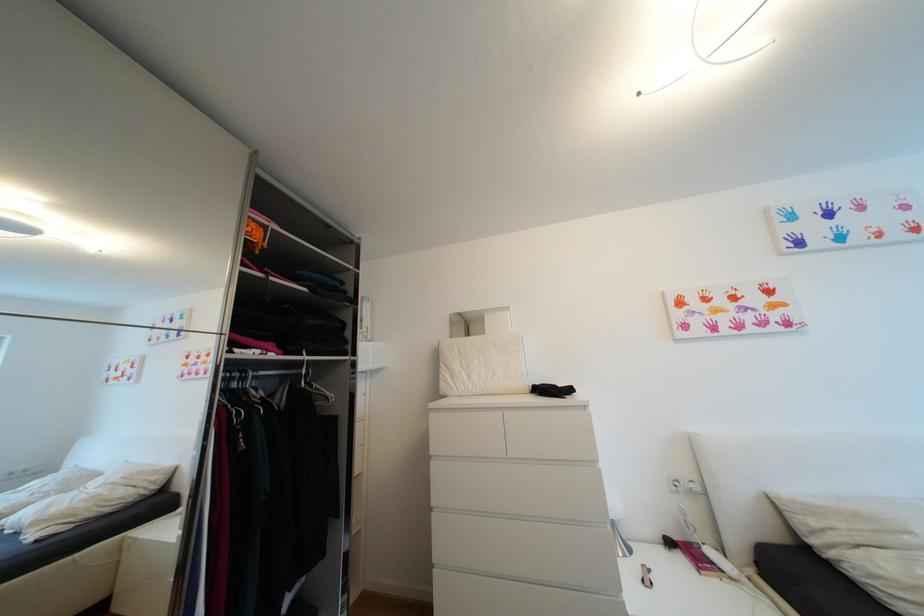
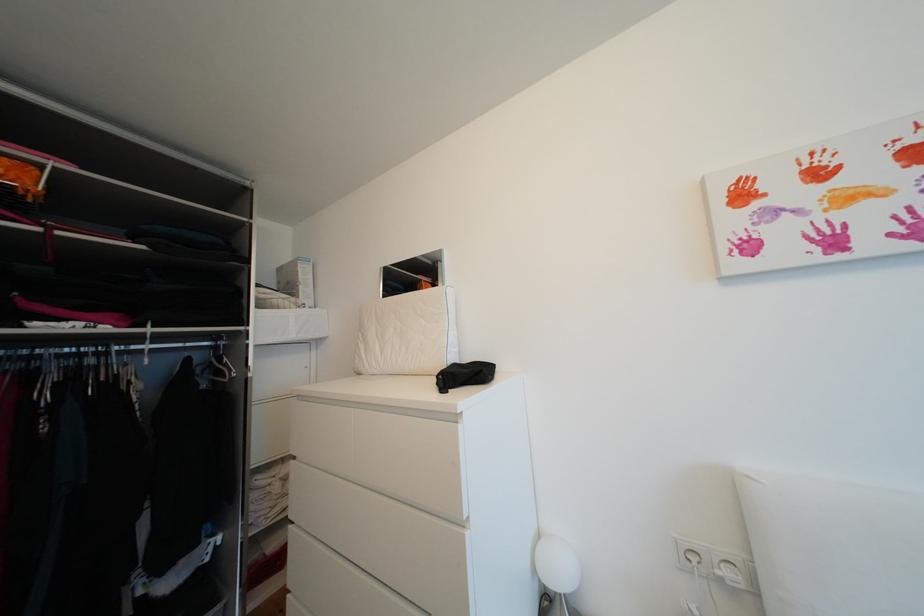
Which direction would the cameraman need to move to produce the second image?

The cameraman moved toward right, forward.